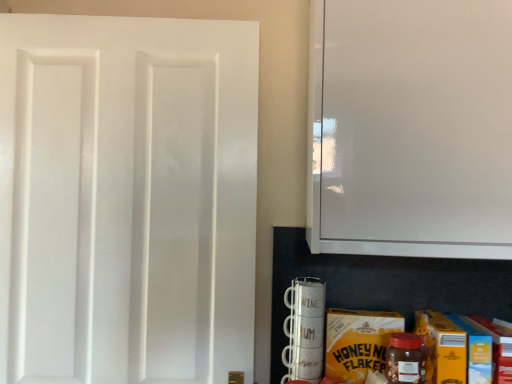
Question: From a real-world perspective, is yellow cardboard carton at lower right on white glossy cabinet at upper right?

Choices:
 (A) yes
 (B) no

Answer: (B)

Question: Is yellow cardboard carton at lower right smaller than white glossy cabinet at upper right?

Choices:
 (A) yes
 (B) no

Answer: (A)

Question: Could you tell me if yellow cardboard carton at lower right is turned towards white glossy cabinet at upper right?

Choices:
 (A) no
 (B) yes

Answer: (A)

Question: Is yellow cardboard carton at lower right taller than white glossy cabinet at upper right?

Choices:
 (A) yes
 (B) no

Answer: (B)

Question: Would you say yellow cardboard carton at lower right is outside white glossy cabinet at upper right?

Choices:
 (A) no
 (B) yes

Answer: (B)

Question: From the image's perspective, is yellow cardboard carton at lower right on white glossy cabinet at upper right?

Choices:
 (A) yes
 (B) no

Answer: (B)

Question: Is white matte door at left in front of yellow cardboard carton at lower right?

Choices:
 (A) yes
 (B) no

Answer: (B)

Question: From a real-world perspective, is white matte door at left positioned over yellow cardboard carton at lower right based on gravity?

Choices:
 (A) no
 (B) yes

Answer: (B)

Question: Is white matte door at left surrounding yellow cardboard carton at lower right?

Choices:
 (A) no
 (B) yes

Answer: (A)

Question: Is yellow cardboard carton at lower right at the back of white matte door at left?

Choices:
 (A) yes
 (B) no

Answer: (B)

Question: Is white matte door at left taller than yellow cardboard carton at lower right?

Choices:
 (A) no
 (B) yes

Answer: (B)

Question: Are white matte door at left and yellow cardboard carton at lower right making contact?

Choices:
 (A) yes
 (B) no

Answer: (B)

Question: Would you say yellow cardboard carton at lower right is outside white matte door at left?

Choices:
 (A) no
 (B) yes

Answer: (B)